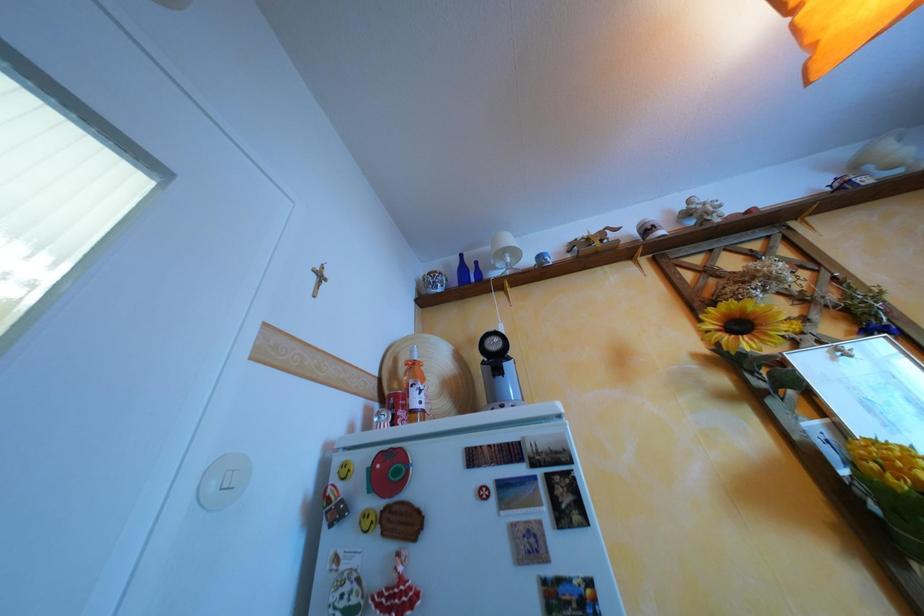
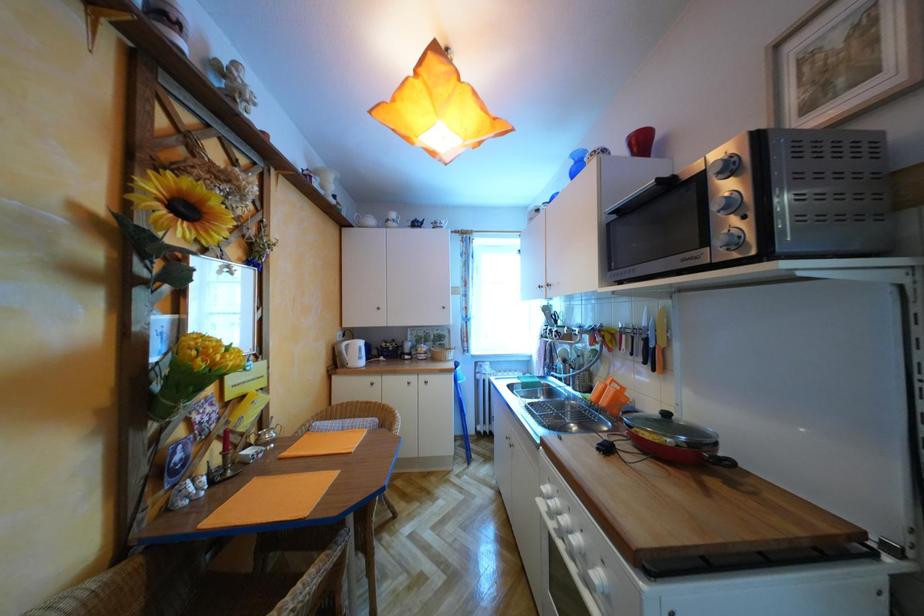
Based on the continuous images, in which direction is the camera rotating?

The rotation direction of the camera is right-up.